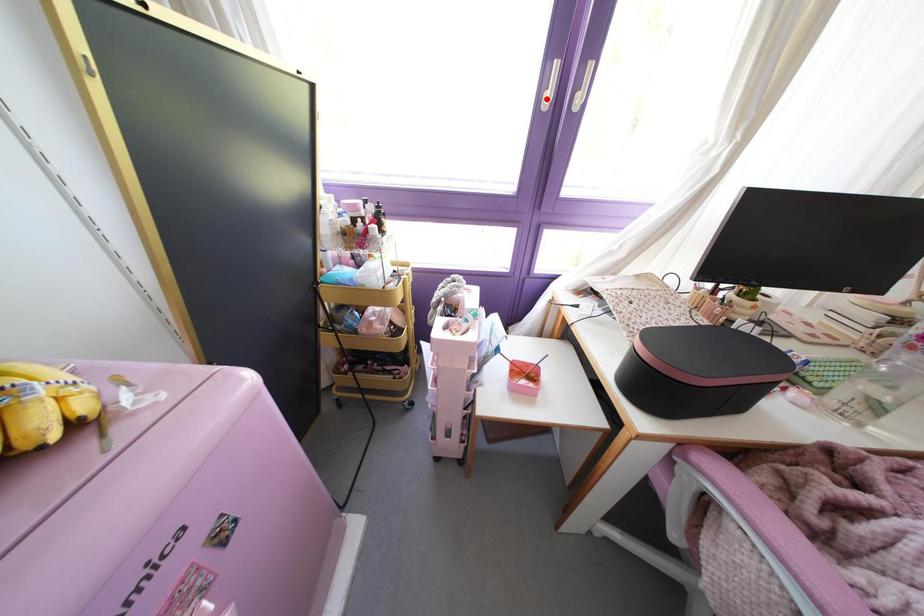
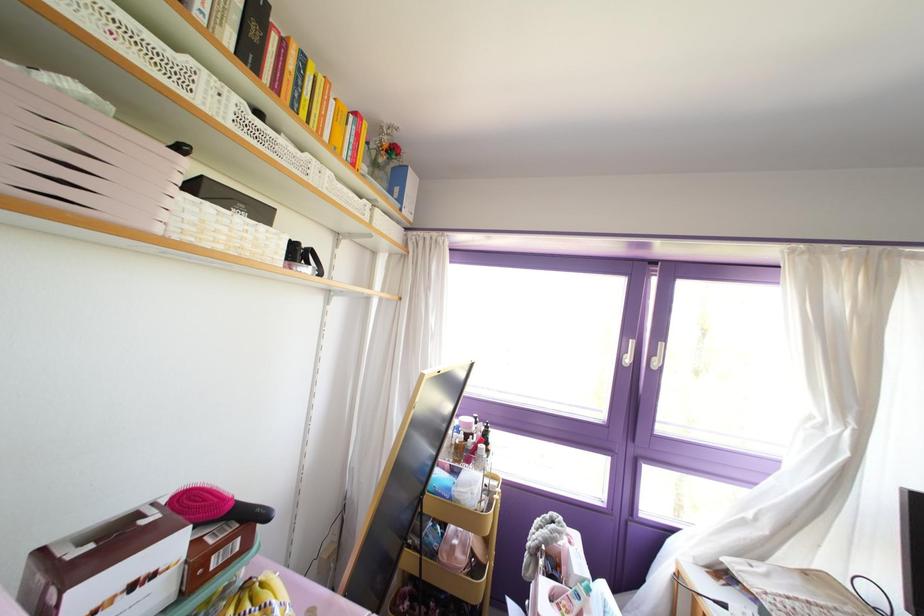
The point at the highlighted location is marked in the first image. Where is the corresponding point in the second image?

(626, 360)